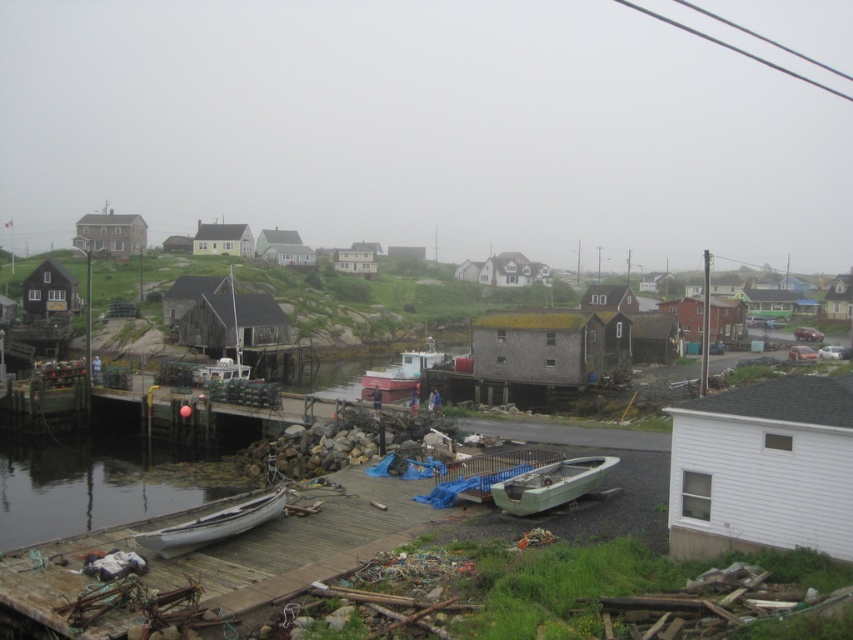
Does point (287, 589) come farther from viewer compared to point (70, 461)?

No, it is not.

How much distance is there between wooden dock at lower left and clear water at dock left?

9.95 meters

Is point (288, 529) closer to camera compared to point (47, 477)?

Yes.

The image size is (853, 640). I want to click on wooden dock at lower left, so click(227, 552).

Between clear water at dock left and green matte boat at lower center, which one appears on the right side from the viewer's perspective?

Positioned to the right is green matte boat at lower center.

Does clear water at dock left lie behind green matte boat at lower center?

Yes, clear water at dock left is further from the viewer.

Which is behind, point (108, 445) or point (558, 486)?

Positioned behind is point (108, 445).

Find the location of `clear water at dock left`. clear water at dock left is located at coordinates (99, 484).

Consider the image. Measure the distance between wooden dock at lower left and camera.

wooden dock at lower left is 14.01 meters from camera.

How distant is wooden dock at lower left from green matte boat at lower center?

wooden dock at lower left and green matte boat at lower center are 5.78 meters apart.

Who is more distant from viewer, (x=280, y=577) or (x=515, y=483)?

Positioned behind is point (x=515, y=483).

You are a GUI agent. You are given a task and a screenshot of the screen. Output one action in this format:
    pyautogui.click(x=<x>, y=<y>)
    Task: Click on the wooden dock at lower left
    The height and width of the screenshot is (640, 853).
    Given the screenshot: What is the action you would take?
    pyautogui.click(x=227, y=552)